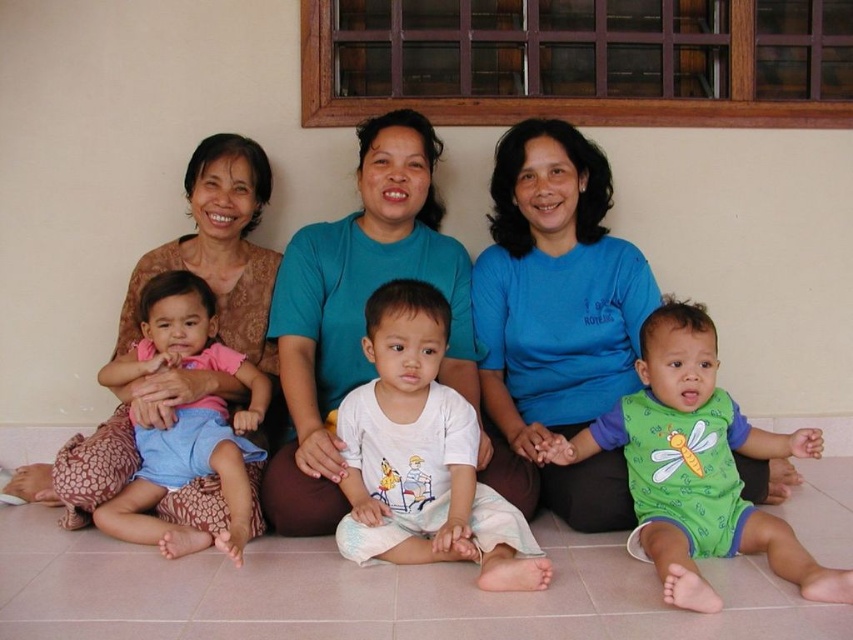
Question: Which object appears closest to the camera in this image?

Choices:
 (A) blue cotton shirt at center
 (B) teal fabric shirt at center
 (C) green cotton onesie at lower right
 (D) pink fabric shirt at left

Answer: (C)

Question: Can you confirm if blue cotton shirt at center is bigger than teal fabric shirt at center?

Choices:
 (A) no
 (B) yes

Answer: (A)

Question: Considering the real-world distances, which object is closest to the white cotton shirt at center?

Choices:
 (A) matte brown lace dress at left
 (B) green cotton onesie at lower right
 (C) blue cotton shirt at center
 (D) teal fabric shirt at center

Answer: (D)

Question: Is blue cotton shirt at center positioned before pink fabric shirt at left?

Choices:
 (A) no
 (B) yes

Answer: (A)

Question: Which object is farther from the camera taking this photo?

Choices:
 (A) teal fabric shirt at center
 (B) white cotton shirt at center
 (C) matte brown lace dress at left
 (D) blue cotton shirt at center

Answer: (D)

Question: Is blue cotton shirt at center to the left of matte brown lace dress at left from the viewer's perspective?

Choices:
 (A) no
 (B) yes

Answer: (A)